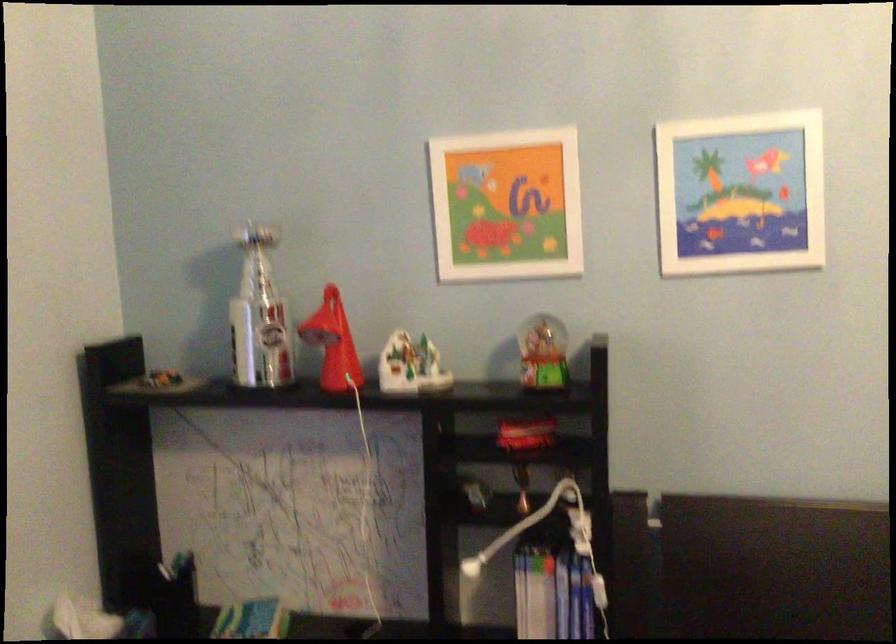
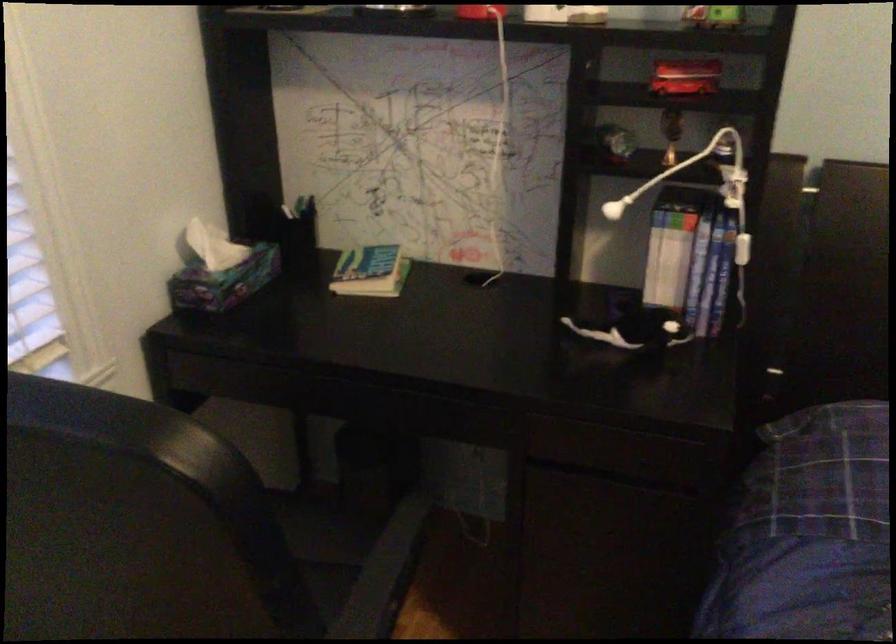
Where in the second image is the point corresponding to the point at 530,429 from the first image?

(685, 77)